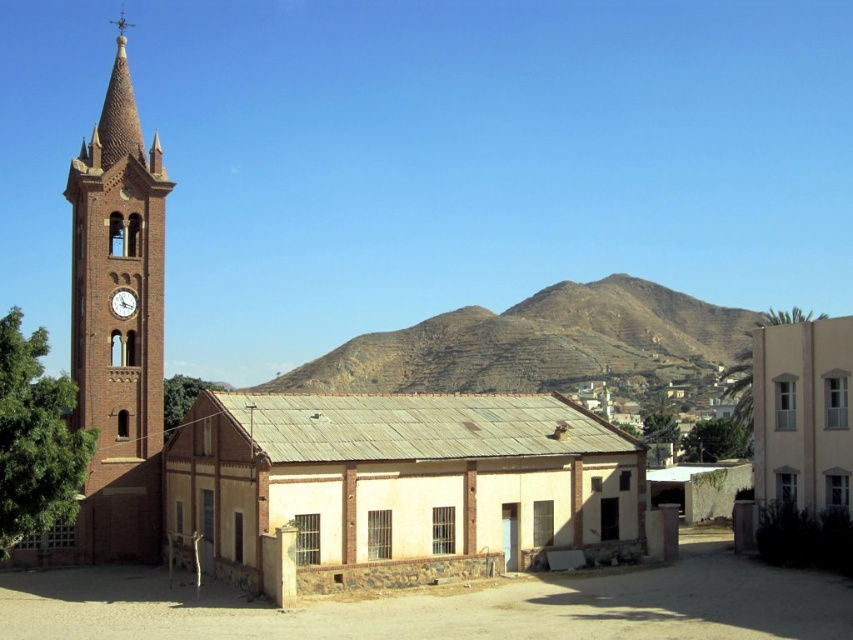
Can you confirm if light beige brick building at center is shorter than matte brown clock at left?

No.

You are a GUI agent. You are given a task and a screenshot of the screen. Output one action in this format:
    pyautogui.click(x=<x>, y=<y>)
    Task: Click on the light beige brick building at center
    
    Given the screenshot: What is the action you would take?
    pyautogui.click(x=398, y=484)

Does point (442, 483) come behind point (115, 307)?

No, (442, 483) is closer to viewer.

Image resolution: width=853 pixels, height=640 pixels. What are the coordinates of `light beige brick building at center` in the screenshot? It's located at (398, 484).

Is the position of light beige brick building at center less distant than that of brown rocky mountain at center?

Yes.

Does light beige brick building at center have a lesser height compared to brown rocky mountain at center?

Indeed, light beige brick building at center has a lesser height compared to brown rocky mountain at center.

Find the location of a particular element. This screenshot has height=640, width=853. light beige brick building at center is located at coordinates (398, 484).

Find the location of a particular element. The image size is (853, 640). brick clock tower at left is located at coordinates (119, 324).

Who is more distant from viewer, (74, 160) or (769, 353)?

Positioned behind is point (74, 160).

Which is in front, point (117, 484) or point (798, 464)?

Point (798, 464) is more forward.

At what (x,y) coordinates should I click in order to perform the action: click on brick clock tower at left. Please return your answer as a coordinate pair (x, y). This screenshot has height=640, width=853. Looking at the image, I should click on (119, 324).